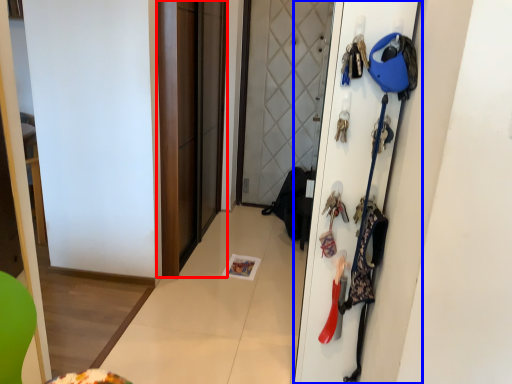
Question: Which of the following is the farthest to the observer, screen door (highlighted by a red box) or door (highlighted by a blue box)?

Choices:
 (A) screen door
 (B) door

Answer: (A)